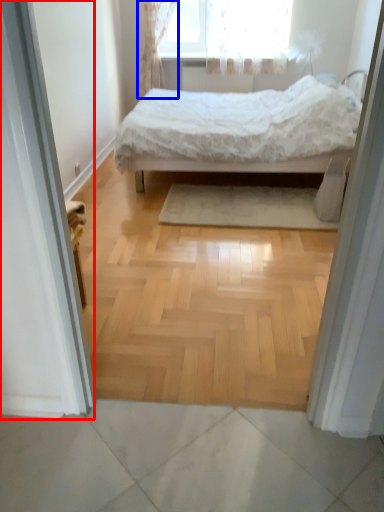
Question: Which object is further to the camera taking this photo, screen door (highlighted by a red box) or curtain (highlighted by a blue box)?

Choices:
 (A) screen door
 (B) curtain

Answer: (B)